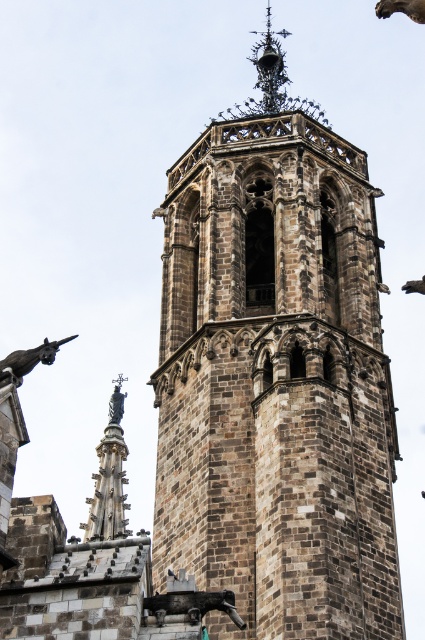
Question: Which object is positioned farthest from the black wrought iron spire at upper center?

Choices:
 (A) brown stone tower at center
 (B) dark gray stone gargoyle at lower left

Answer: (B)

Question: Does brown stone tower at center appear on the right side of dark gray stone gargoyle at lower left?

Choices:
 (A) yes
 (B) no

Answer: (A)

Question: Which of the following is the closest to the observer?

Choices:
 (A) black wrought iron spire at upper center
 (B) dark gray stone gargoyle at lower left
 (C) brown stone tower at center

Answer: (B)

Question: Which of these objects is positioned closest to the black wrought iron spire at upper center?

Choices:
 (A) brown stone tower at center
 (B) dark gray stone gargoyle at lower left

Answer: (A)

Question: Where is black wrought iron spire at upper center located in relation to dark gray stone gargoyle at lower left in the image?

Choices:
 (A) below
 (B) above

Answer: (B)

Question: Is brown stone tower at center above black wrought iron spire at upper center?

Choices:
 (A) no
 (B) yes

Answer: (A)